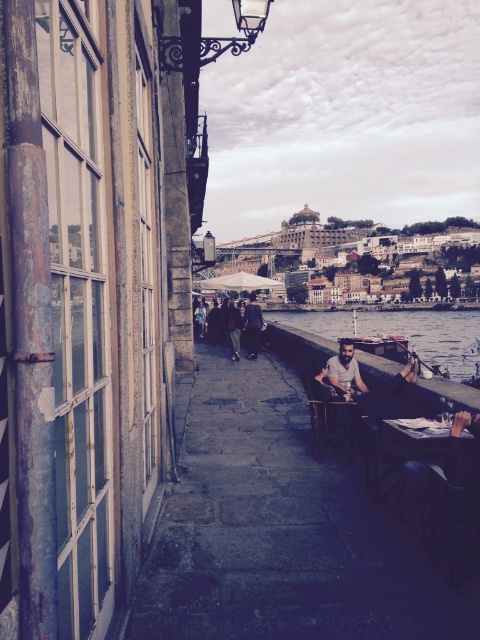
Question: Is light brown wooden chair at center in front of dark brown leather jacket at center?

Choices:
 (A) no
 (B) yes

Answer: (B)

Question: Is clear water at dock center positioned in front of dark brown leather jacket at center?

Choices:
 (A) yes
 (B) no

Answer: (B)

Question: Which point is farther from the camera taking this photo?

Choices:
 (A) (231, 333)
 (B) (399, 428)
 (C) (339, 355)

Answer: (A)

Question: Does dark wood table at lower right have a smaller size compared to light brown wooden chair at center?

Choices:
 (A) no
 (B) yes

Answer: (A)

Question: Which is farther from the dark gray fabric jacket at center?

Choices:
 (A) light brown wooden chair at center
 (B) dark brown leather jacket at center

Answer: (A)

Question: Which object is the closest to the dark gray fabric jacket at center?

Choices:
 (A) dark brown leather jacket at center
 (B) clear water at dock center

Answer: (A)